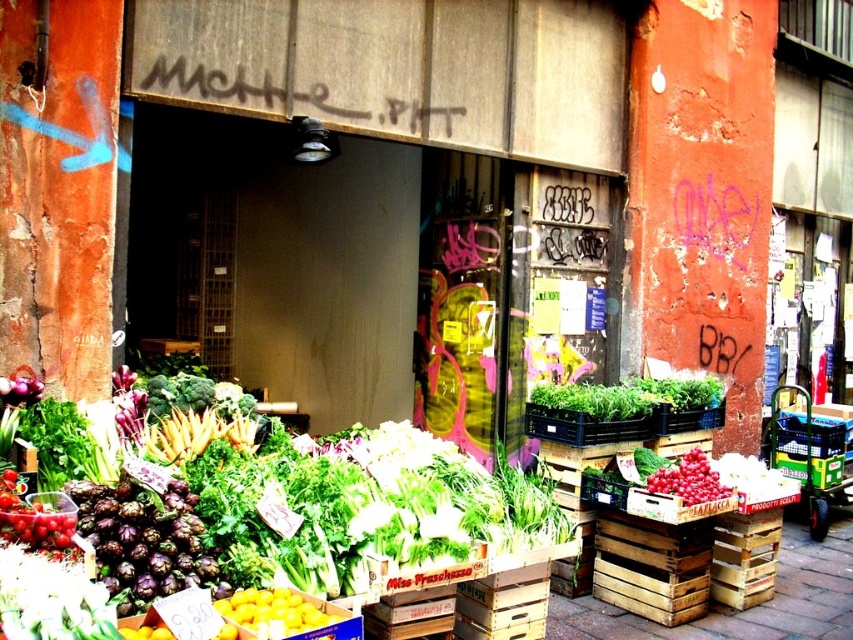
Question: Is yellow matte lemons at center thinner than red matte tomatoes at center?

Choices:
 (A) yes
 (B) no

Answer: (A)

Question: Can you confirm if yellow matte lemons at center is positioned above red matte tomatoes at center?

Choices:
 (A) yes
 (B) no

Answer: (B)

Question: Which point is closer to the camera?

Choices:
 (A) (701, 497)
 (B) (270, 589)

Answer: (B)

Question: Which point is farther to the camera?

Choices:
 (A) yellow matte lemons at center
 (B) red matte tomatoes at center

Answer: (B)

Question: Among these points, which one is farthest from the camera?

Choices:
 (A) [325, 621]
 (B) [694, 470]

Answer: (B)

Question: Does yellow matte lemons at center lie behind red matte tomatoes at center?

Choices:
 (A) yes
 (B) no

Answer: (B)